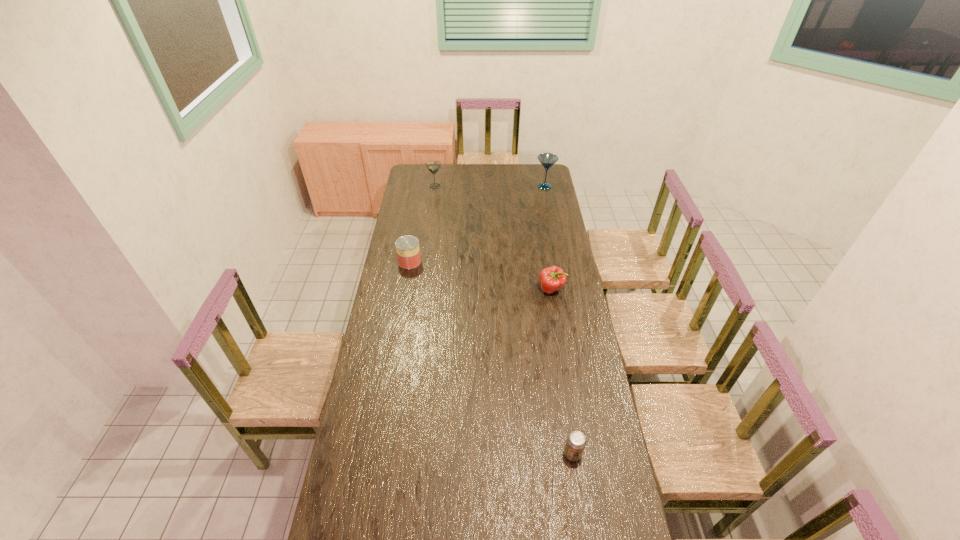
Find the location of a particular element. vacant area that lies between the can and the nearest object is located at coordinates (492, 357).

This screenshot has width=960, height=540. What are the coordinates of `the closest object to the right martini` in the screenshot? It's located at (433, 166).

Image resolution: width=960 pixels, height=540 pixels. In order to click on object that is the third closest to the nearest object in this screenshot , I will do `click(547, 160)`.

At what (x,y) coordinates should I click in order to perform the action: click on blank area in the image that satisfies the following two spatial constraints: 1. on the back side of the third nearest object; 2. on the right side of the second tallest object. Please return your answer as a coordinate pair (x, y). The width and height of the screenshot is (960, 540). Looking at the image, I should click on point(422,186).

Where is `free space that satisfies the following two spatial constraints: 1. on the front side of the can; 2. on the left side of the nearest object`? Image resolution: width=960 pixels, height=540 pixels. free space that satisfies the following two spatial constraints: 1. on the front side of the can; 2. on the left side of the nearest object is located at coordinates (376, 454).

Find the location of a particular element. The height and width of the screenshot is (540, 960). free space that satisfies the following two spatial constraints: 1. on the front side of the third nearest object; 2. on the right side of the nearest object is located at coordinates (376, 454).

The width and height of the screenshot is (960, 540). I want to click on free spot that satisfies the following two spatial constraints: 1. on the back side of the right martini; 2. on the right side of the pepper, so click(x=535, y=186).

I want to click on free space that satisfies the following two spatial constraints: 1. on the front side of the right martini; 2. on the left side of the left martini, so click(x=435, y=186).